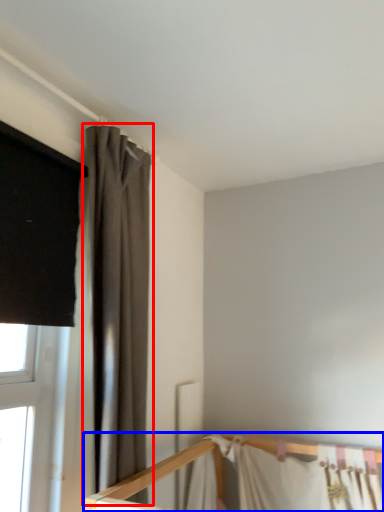
Question: Which point is further to the camera, curtain (highlighted by a red box) or bed (highlighted by a blue box)?

Choices:
 (A) curtain
 (B) bed

Answer: (B)